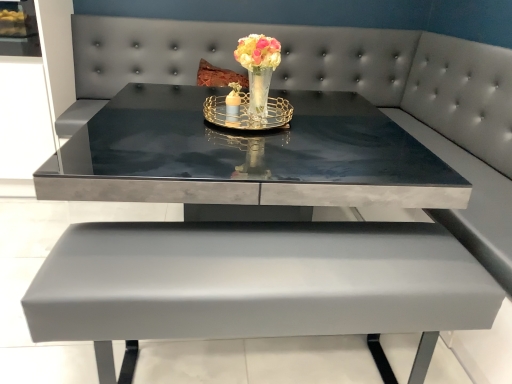
Question: Is the position of glossy concrete table at center more distant than that of gold metallic tray at center?

Choices:
 (A) yes
 (B) no

Answer: (B)

Question: Can you confirm if glossy concrete table at center is smaller than gold metallic tray at center?

Choices:
 (A) no
 (B) yes

Answer: (A)

Question: From the image's perspective, is glossy concrete table at center located beneath gold metallic tray at center?

Choices:
 (A) yes
 (B) no

Answer: (A)

Question: From a real-world perspective, is glossy concrete table at center positioned under gold metallic tray at center based on gravity?

Choices:
 (A) yes
 (B) no

Answer: (A)

Question: Are glossy concrete table at center and gold metallic tray at center far apart?

Choices:
 (A) yes
 (B) no

Answer: (B)

Question: Considering the relative sizes of glossy concrete table at center and gold metallic tray at center in the image provided, is glossy concrete table at center thinner than gold metallic tray at center?

Choices:
 (A) no
 (B) yes

Answer: (A)

Question: Does glossy concrete table at center have a smaller size compared to glossy glass vase at center?

Choices:
 (A) yes
 (B) no

Answer: (B)

Question: From a real-world perspective, is glossy concrete table at center below glossy glass vase at center?

Choices:
 (A) no
 (B) yes

Answer: (B)

Question: Is glossy glass vase at center at the back of glossy concrete table at center?

Choices:
 (A) no
 (B) yes

Answer: (A)

Question: Does glossy concrete table at center have a larger size compared to glossy glass vase at center?

Choices:
 (A) yes
 (B) no

Answer: (A)

Question: Is glossy concrete table at center not close to glossy glass vase at center?

Choices:
 (A) no
 (B) yes

Answer: (A)

Question: Is glossy glass vase at center completely or partially inside glossy concrete table at center?

Choices:
 (A) no
 (B) yes

Answer: (A)

Question: Is glossy glass vase at center shorter than glossy concrete table at center?

Choices:
 (A) yes
 (B) no

Answer: (A)